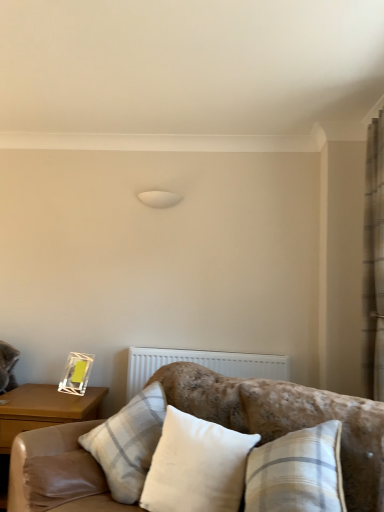
Question: Can velvet beige couch at lower center be found inside white cotton pillow at center, which ranks as the 2th pillow in back-to-front order?

Choices:
 (A) no
 (B) yes

Answer: (A)

Question: Is white cotton pillow at center, which ranks as the 2th pillow in back-to-front order, taller than velvet beige couch at lower center?

Choices:
 (A) yes
 (B) no

Answer: (B)

Question: Could you tell me if white cotton pillow at center, which ranks as the 1th pillow in front-to-back order, is facing velvet beige couch at lower center?

Choices:
 (A) yes
 (B) no

Answer: (A)

Question: Considering the relative sizes of white cotton pillow at center, which ranks as the 2th pillow in back-to-front order, and velvet beige couch at lower center in the image provided, is white cotton pillow at center, which ranks as the 2th pillow in back-to-front order, wider than velvet beige couch at lower center?

Choices:
 (A) yes
 (B) no

Answer: (B)

Question: From the image's perspective, does white cotton pillow at center, which ranks as the 1th pillow in front-to-back order, appear lower than velvet beige couch at lower center?

Choices:
 (A) no
 (B) yes

Answer: (A)

Question: Considering the positions of white fabric pillow at center, which is counted as the first pillow, starting from the back, and wooden nightstand at left in the image, is white fabric pillow at center, which is counted as the first pillow, starting from the back, wider or thinner than wooden nightstand at left?

Choices:
 (A) wide
 (B) thin

Answer: (B)

Question: Would you say white fabric pillow at center, marked as the second pillow in a front-to-back arrangement, is to the left or to the right of wooden nightstand at left in the picture?

Choices:
 (A) left
 (B) right

Answer: (B)

Question: From the image's perspective, is white fabric pillow at center, marked as the second pillow in a front-to-back arrangement, above or below wooden nightstand at left?

Choices:
 (A) above
 (B) below

Answer: (A)

Question: Is white fabric pillow at center, which is counted as the first pillow, starting from the back, situated inside wooden nightstand at left or outside?

Choices:
 (A) outside
 (B) inside

Answer: (A)

Question: From the image's perspective, relative to white fabric pillow at center, marked as the second pillow in a front-to-back arrangement, is white cotton pillow at center, which ranks as the 1th pillow in front-to-back order, above or below?

Choices:
 (A) below
 (B) above

Answer: (A)

Question: In the image, is white cotton pillow at center, which ranks as the 1th pillow in front-to-back order, positioned in front of or behind white fabric pillow at center, which is counted as the first pillow, starting from the back?

Choices:
 (A) behind
 (B) front

Answer: (B)

Question: Is white cotton pillow at center, which ranks as the 2th pillow in back-to-front order, wider or thinner than white fabric pillow at center, which is counted as the first pillow, starting from the back?

Choices:
 (A) wide
 (B) thin

Answer: (B)

Question: Does point pos(163,446) appear closer or farther from the camera than point pos(147,433)?

Choices:
 (A) closer
 (B) farther

Answer: (A)

Question: Relative to white cotton pillow at center, which ranks as the 2th pillow in back-to-front order, is white textured radiator at center in front or behind?

Choices:
 (A) behind
 (B) front

Answer: (A)

Question: Is point (284, 357) closer or farther from the camera than point (198, 508)?

Choices:
 (A) closer
 (B) farther

Answer: (B)